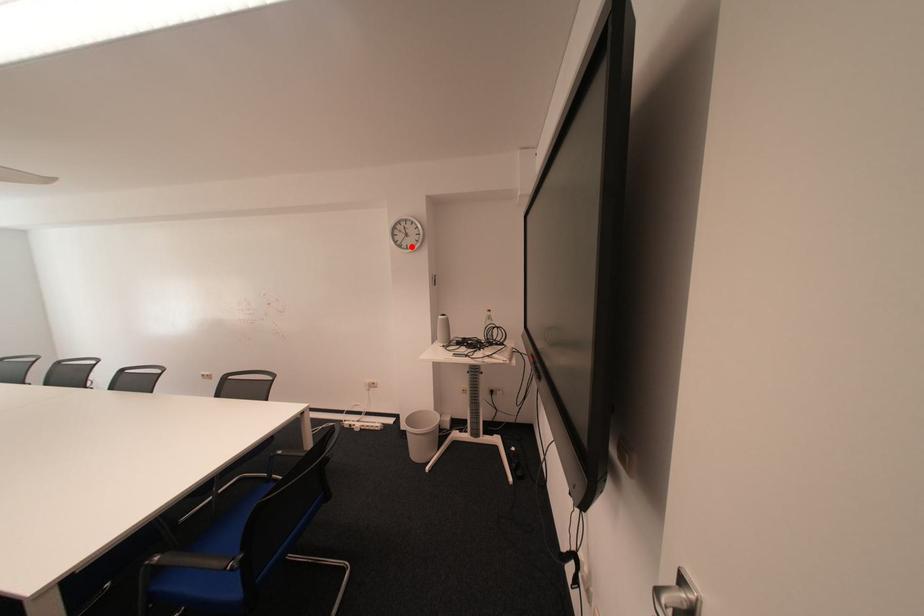
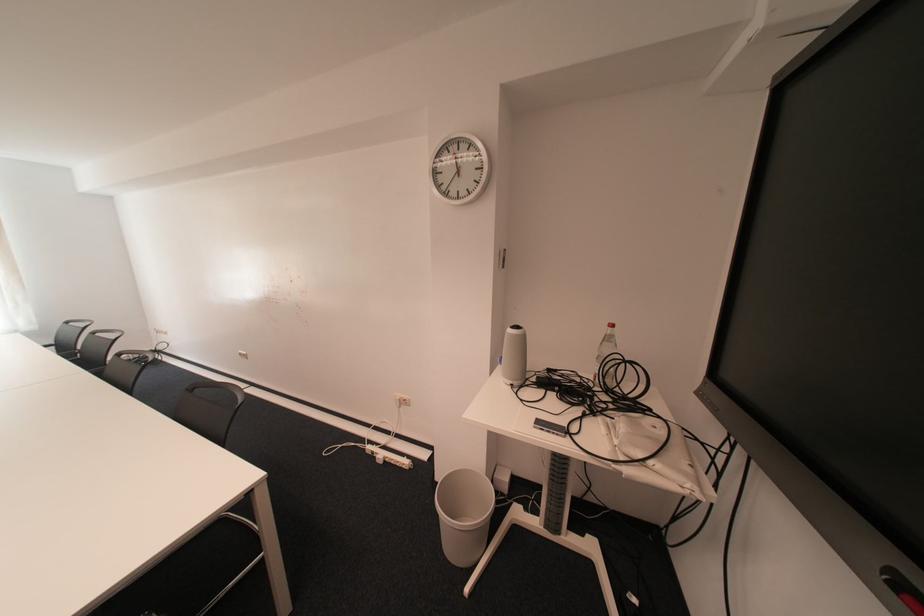
Find the pixel in the second image that matches the highlighted location in the first image.

(457, 195)